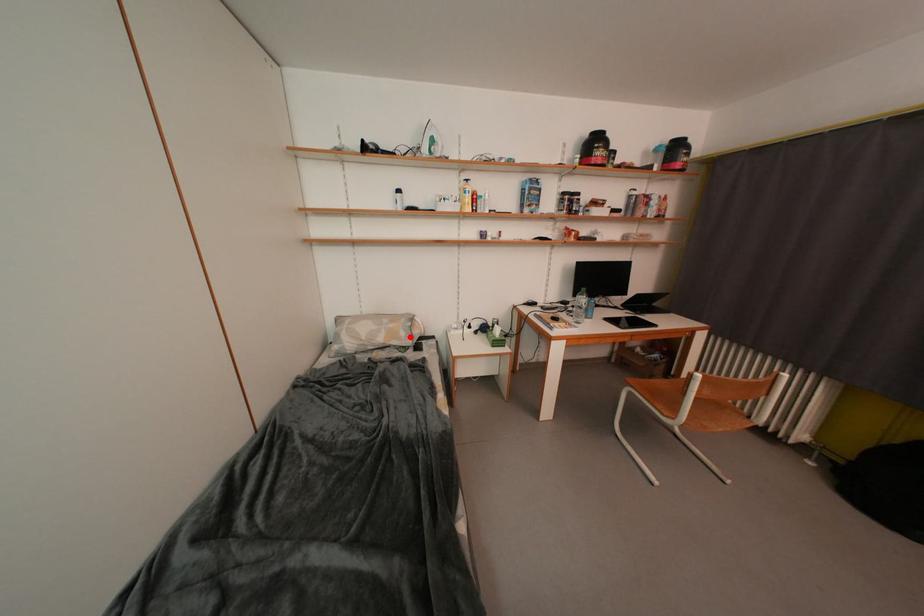
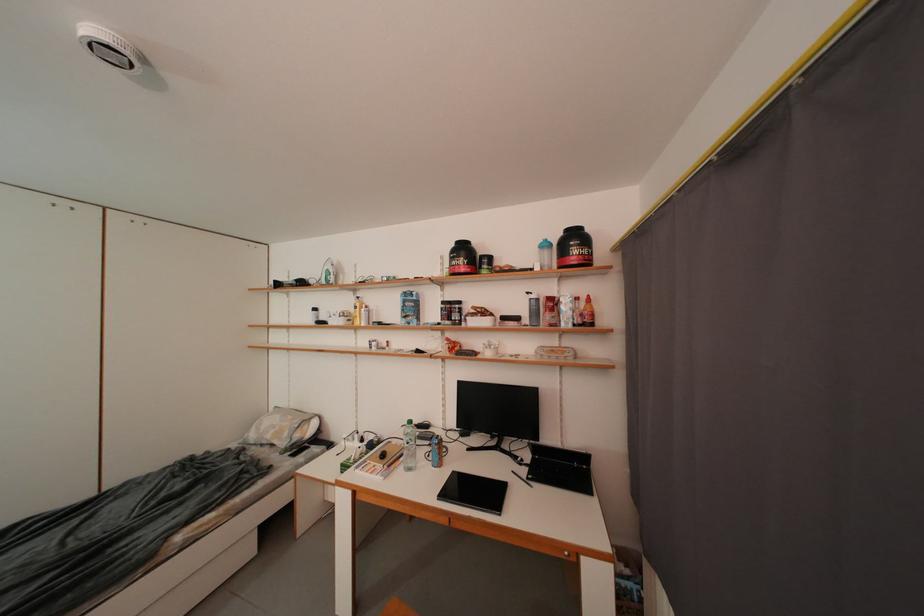
The point at the highlighted location is marked in the first image. Where is the corresponding point in the second image?

(294, 438)